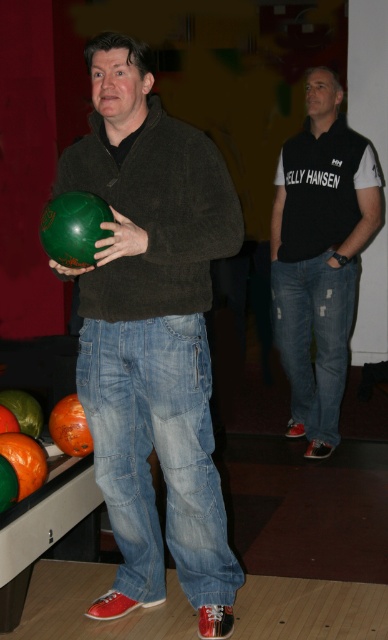
You are a delivery person who needs to place a package between the black jersey at center and the green matte bowling ball at center. The package requires a space of 6 feet. Can you fit it there?

The black jersey at center is 6.80 feet away from the green matte bowling ball at center. Since the required space is 6 feet, the package can fit between them as the distance is sufficient.

You are a bowler standing at the approach area and want to pick up the matte green bowling ball at left and the black jersey at center. Which one is closer to your current position?

The matte green bowling ball at left is closer to your current position because it is to the left of the black jersey at center.

You are a bowling alley attendant and need to determine which item is bigger between the matte green bowling ball at left and the ripped denim jeans at center. Which one should you choose?

The matte green bowling ball at left is larger in size than the ripped denim jeans at center, so you should choose the matte green bowling ball at left as the bigger item.